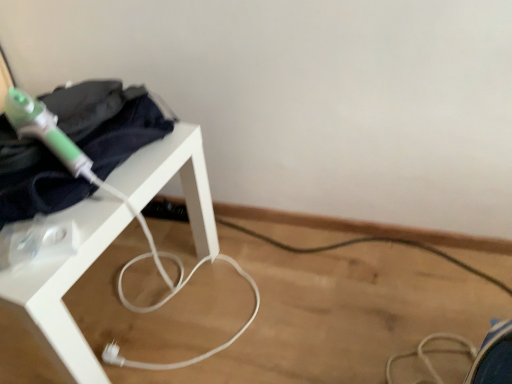
Question: Relative to white matte table at left, is dark blue fabric at upper left in front or behind?

Choices:
 (A) front
 (B) behind

Answer: (B)

Question: From the image's perspective, relative to white matte table at left, is dark blue fabric at upper left above or below?

Choices:
 (A) above
 (B) below

Answer: (A)

Question: Considering the positions of point (142, 125) and point (38, 297), is point (142, 125) closer or farther from the camera than point (38, 297)?

Choices:
 (A) farther
 (B) closer

Answer: (A)

Question: Is white matte table at left taller or shorter than dark blue fabric at upper left?

Choices:
 (A) tall
 (B) short

Answer: (A)

Question: In terms of width, does white matte table at left look wider or thinner when compared to dark blue fabric at upper left?

Choices:
 (A) thin
 (B) wide

Answer: (B)

Question: Relative to dark blue fabric at upper left, is white matte table at left in front or behind?

Choices:
 (A) behind
 (B) front

Answer: (B)

Question: Is white matte table at left spatially inside dark blue fabric at upper left, or outside of it?

Choices:
 (A) outside
 (B) inside

Answer: (A)